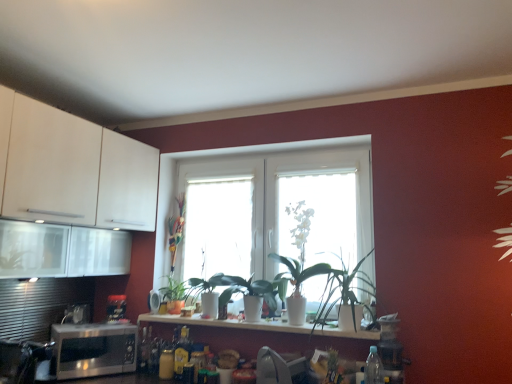
Question: From a real-world perspective, is white glossy vase at center, the 3th window in the left-to-right sequence, positioned above or below multicolored plastic plant at center, which is the fifth plant in right-to-left order?

Choices:
 (A) below
 (B) above

Answer: (A)

Question: Does point (283, 195) appear closer or farther from the camera than point (181, 221)?

Choices:
 (A) farther
 (B) closer

Answer: (B)

Question: Considering the real-world distances, which object is farthest from the transparent glass window at center, which is counted as the 1th window, starting from the left?

Choices:
 (A) white glossy window at center, which is the 2th window in right-to-left order
 (B) satin silver toaster at lower left, the second appliance viewed from the right
 (C) multicolored plastic plant at center, which is the fifth plant in right-to-left order
 (D) green matte plant at center, positioned as the first plant in right-to-left order
 (E) white glossy vase at center, the second plant viewed from the right

Answer: (B)

Question: Which object is the farthest from the green glossy plant at center, which appears as the 3th plant when viewed from the left?

Choices:
 (A) metallic black toaster at lower left, the 1th appliance from the right
 (B) white matte cabinet at upper left
 (C) white glossy vase at center, the 3th window in the left-to-right sequence
 (D) satin silver toaster at lower left, which appears as the first appliance when viewed from the left
 (E) white glossy countertop at center

Answer: (D)